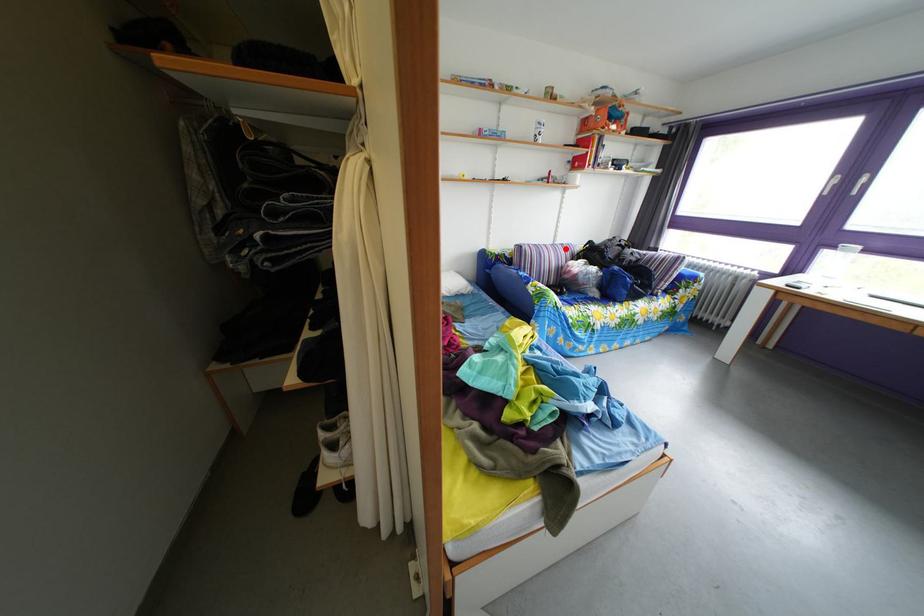
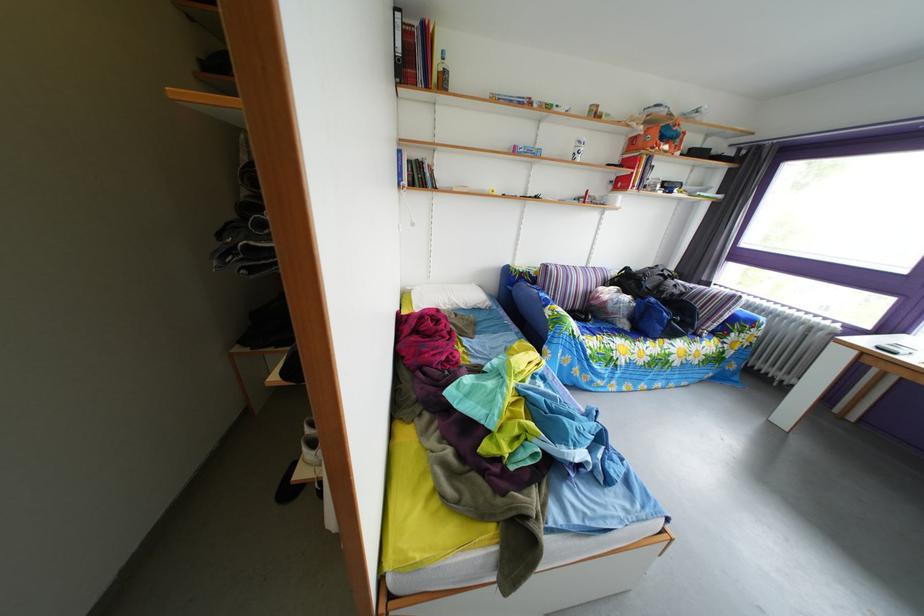
Question: I am providing you with two images of the same scene from different viewpoints. In image1, a red point is highlighted. Considering the same 3D point in image2, which of the following is correct?

Choices:
 (A) It is closer
 (B) It is farther

Answer: (B)